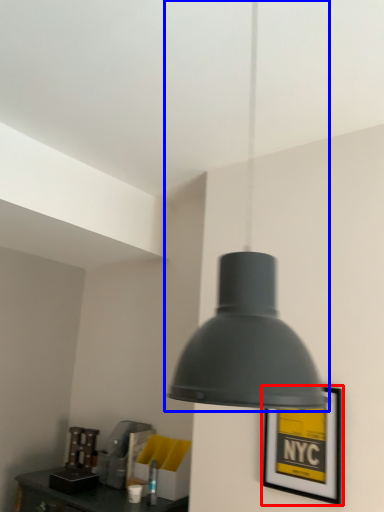
Question: Which object appears closest to the camera in this image, picture frame (highlighted by a red box) or lamp (highlighted by a blue box)?

Choices:
 (A) picture frame
 (B) lamp

Answer: (B)